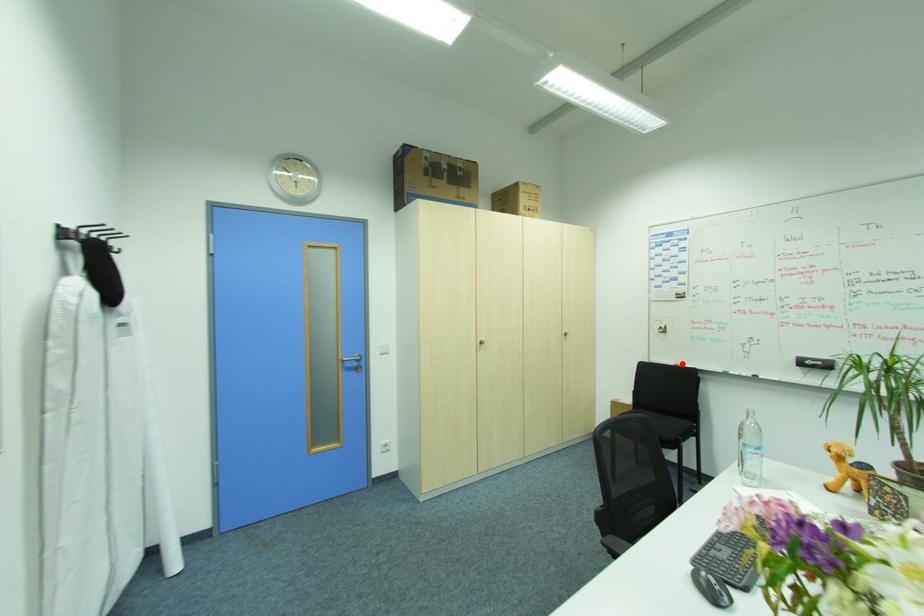
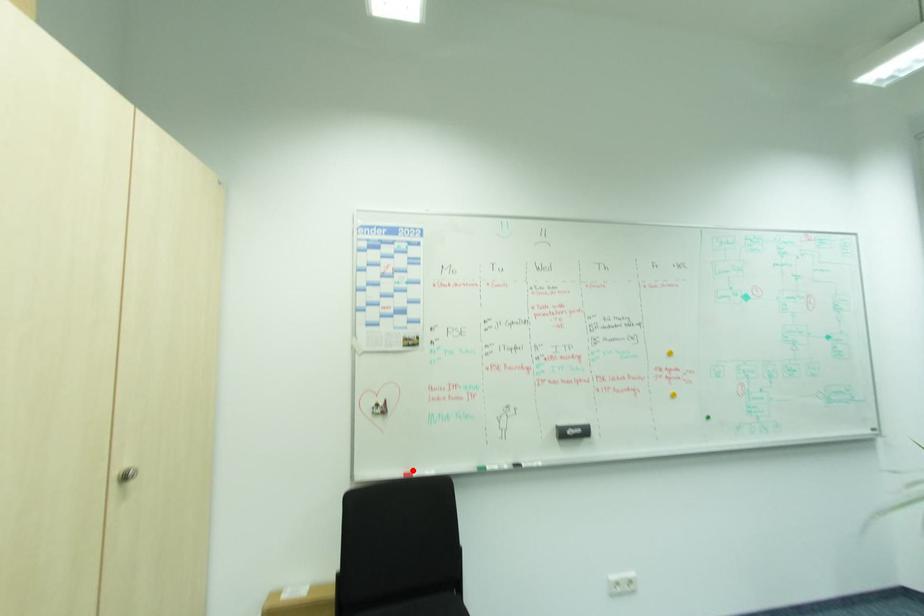
I am providing you with two images of the same scene from different viewpoints. A red point is marked on the first image and another point is marked on the second image. Are the points marked in image1 and image2 representing the same 3D position?

Yes